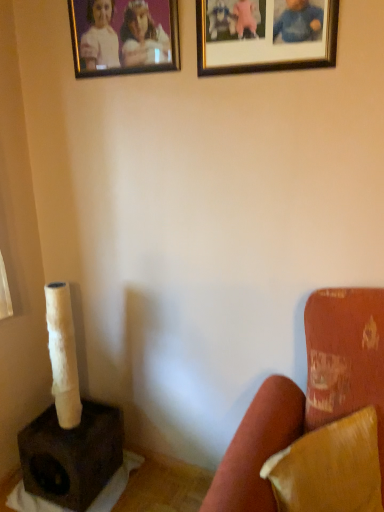
Question: Does leather-like brown pillow at lower right have a smaller size compared to velvet red armchair at lower right?

Choices:
 (A) no
 (B) yes

Answer: (B)

Question: From a real-world perspective, is leather-like brown pillow at lower right under velvet red armchair at lower right?

Choices:
 (A) no
 (B) yes

Answer: (A)

Question: From the image's perspective, is leather-like brown pillow at lower right on velvet red armchair at lower right?

Choices:
 (A) yes
 (B) no

Answer: (A)

Question: Is leather-like brown pillow at lower right closer to the viewer compared to velvet red armchair at lower right?

Choices:
 (A) no
 (B) yes

Answer: (A)

Question: Considering the relative sizes of leather-like brown pillow at lower right and velvet red armchair at lower right in the image provided, is leather-like brown pillow at lower right thinner than velvet red armchair at lower right?

Choices:
 (A) yes
 (B) no

Answer: (A)

Question: Can you confirm if leather-like brown pillow at lower right is taller than velvet red armchair at lower right?

Choices:
 (A) no
 (B) yes

Answer: (A)

Question: Is dark brown matte speaker at lower left at the right side of gold-framed photo at upper center, which ranks as the first picture frame in left-to-right order?

Choices:
 (A) no
 (B) yes

Answer: (A)

Question: Is dark brown matte speaker at lower left positioned in front of gold-framed photo at upper center, which ranks as the first picture frame in left-to-right order?

Choices:
 (A) no
 (B) yes

Answer: (A)

Question: Considering the relative sizes of dark brown matte speaker at lower left and gold-framed photo at upper center, which ranks as the first picture frame in left-to-right order, in the image provided, is dark brown matte speaker at lower left shorter than gold-framed photo at upper center, which ranks as the first picture frame in left-to-right order,?

Choices:
 (A) yes
 (B) no

Answer: (A)

Question: Can you confirm if dark brown matte speaker at lower left is positioned to the left of gold-framed photo at upper center, which ranks as the first picture frame in left-to-right order?

Choices:
 (A) yes
 (B) no

Answer: (A)

Question: Considering the relative sizes of dark brown matte speaker at lower left and gold-framed photo at upper center, the second picture frame in the right-to-left sequence, in the image provided, is dark brown matte speaker at lower left taller than gold-framed photo at upper center, the second picture frame in the right-to-left sequence,?

Choices:
 (A) yes
 (B) no

Answer: (B)

Question: Is dark brown matte speaker at lower left not inside gold-framed photo at upper center, which ranks as the first picture frame in left-to-right order?

Choices:
 (A) no
 (B) yes

Answer: (B)

Question: Is dark brown matte speaker at lower left shorter than gold-framed picture at upper center, the 2th picture frame when ordered from left to right?

Choices:
 (A) no
 (B) yes

Answer: (B)